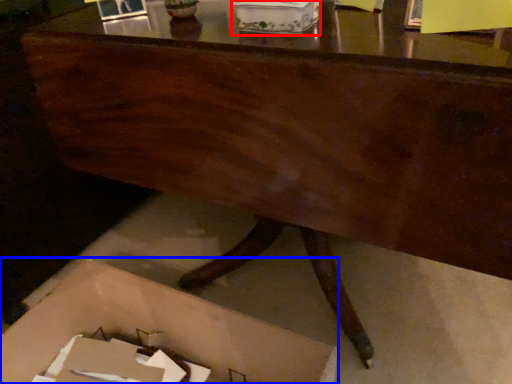
Question: Among these objects, which one is nearest to the camera, storage box (highlighted by a red box) or storage box (highlighted by a blue box)?

Choices:
 (A) storage box
 (B) storage box

Answer: (B)